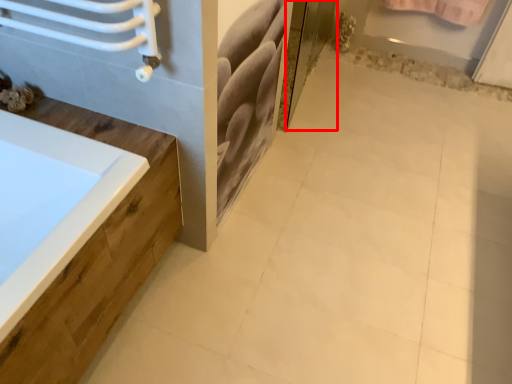
Question: Where is screen door (annotated by the red box) located in relation to ceramic tile in the image?

Choices:
 (A) right
 (B) left

Answer: (B)